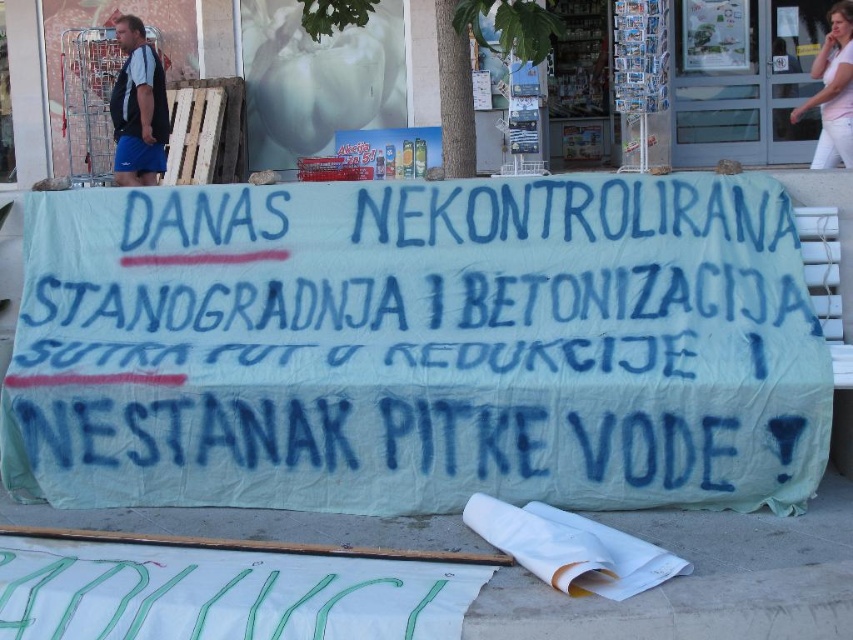
What is the location of the point with coordinates (416, 346) in the image?

The point with coordinates (416, 346) is located on the white fabric banner at center.

You are a photographer standing in front of the protest banner. You want to focus your camera on the point that is closer to you. Which point should you choose between the point at coordinates point (383, 339) and the point at coordinates point (140, 528)?

You should focus on point (140, 528) because it is closer to you than point (383, 339).

You are a photographer trying to capture the protest banner clearly. You notice a white paper at lower center and blue fabric shorts at left in your frame. Which object should you adjust to ensure the protest banner is visible?

The white paper at lower center is in front of the blue fabric shorts at left. To ensure the protest banner is visible, you should move the white paper at lower center out of the way since it is blocking the view of the blue fabric shorts at left and possibly the banner itself.